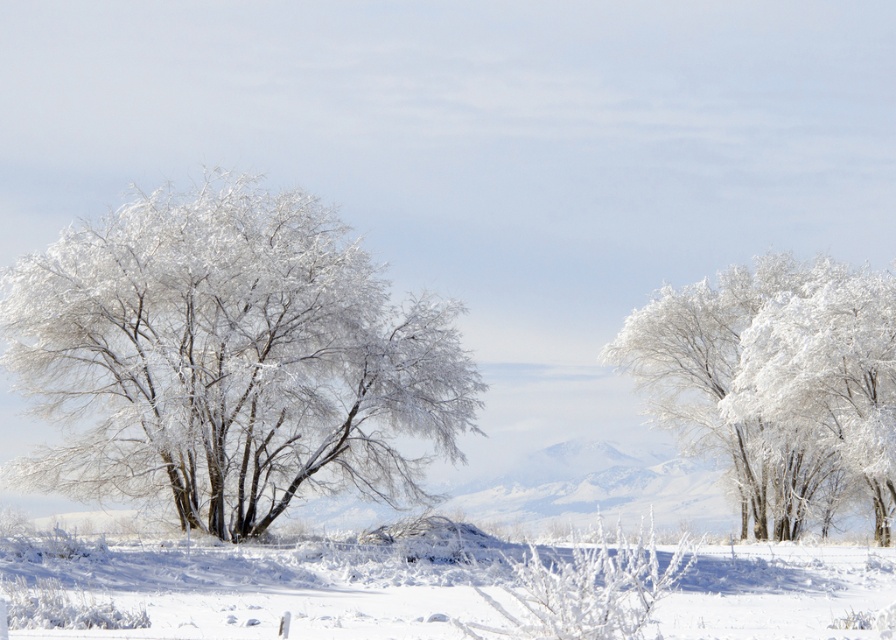
Looking at this image, you are standing at the center of the snowy landscape. Looking towards the point marked at coordinates (228, 358), what object do you see there?

The point at coordinates (228, 358) corresponds to the frosted white tree at left.

You are an observer standing in the middle of the winter landscape. You notice the frosted white tree at left and the frosted white trees at center. Which group of trees is taller?

The frosted white trees at center are taller than the frosted white tree at left.

You are an observer standing in the snowy landscape. You notice the frosted white tree at left and the frosted white trees at center. Which group of trees is positioned higher in the image?

The frosted white tree at left is located above the frosted white trees at center, so it is positioned higher in the image.